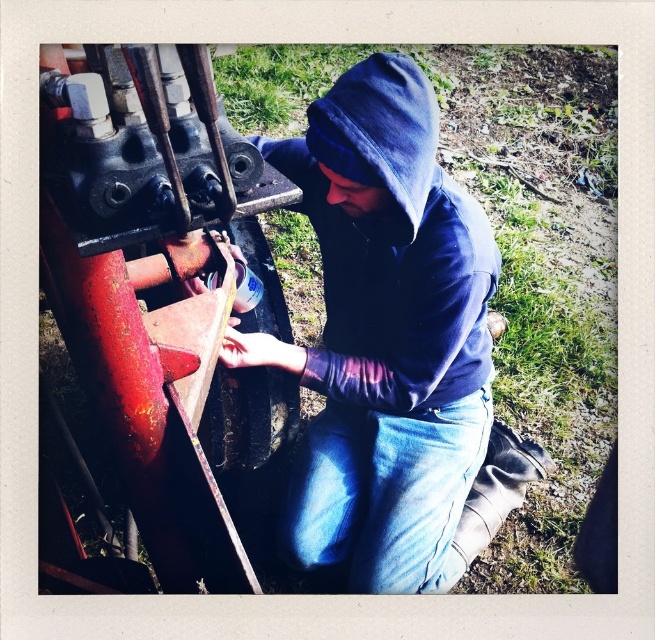
You are a drone operator trying to locate the denim in the image. The image has a coordinate system where the bottom left corner is the origin point. The denim is at point (388, 497). Which direction should you move the drone from the origin to reach the denim?

The denim is located at coordinate point (388, 497). Since the origin is at the bottom left corner, moving the drone to the right and upwards will reach the denim.

You are a drone operator trying to locate the person in the field. According to the coordinates provided, where is the denim at center positioned relative to the machinery?

The denim at center is located at point (388,497), which would place it near the machinery the person is working on.